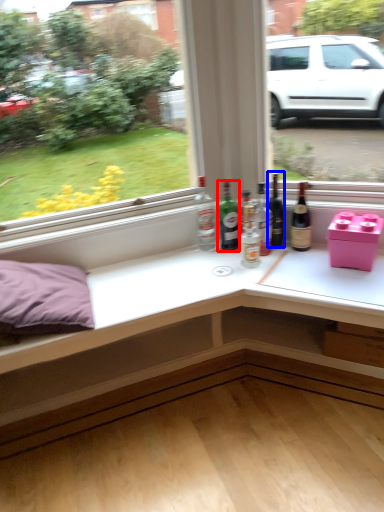
Question: Which object is further to the camera taking this photo, bottle (highlighted by a red box) or beer bottle (highlighted by a blue box)?

Choices:
 (A) bottle
 (B) beer bottle

Answer: (A)